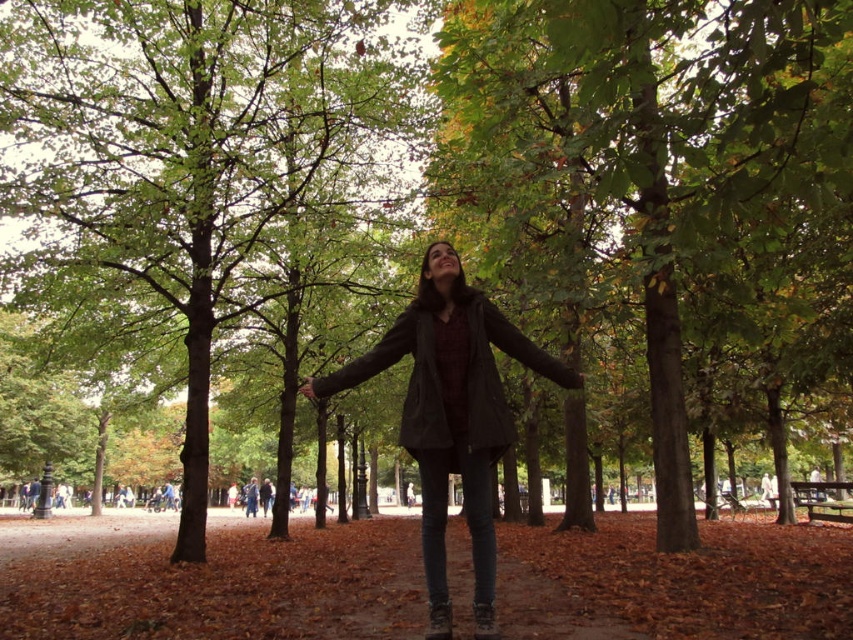
From the picture: You are a photographer standing in the park and want to take a closeup shot of the matte black jacket at center. Your camera has a minimum focusing distance of 3 meters. Can you get the closeup without moving closer?

The matte black jacket at center is 3.78 meters away from the viewer. Since the camera can focus as close as 3 meters, you can take the closeup without moving closer because the distance is within the camera s minimum focusing range.

You are standing in the park and see the green matte tree at center and the matte black jacket at center. Which object is positioned to the right side?

The green matte tree at center is to the right of the matte black jacket at center.